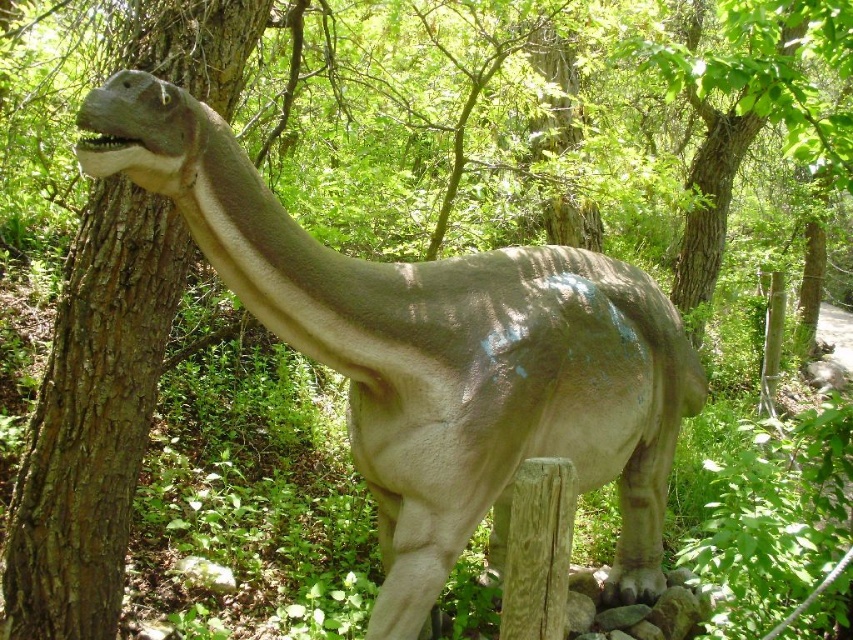
You are a tour guide leading a group of children through a museum. You want to ensure that the children maintain a safe distance of at least 2 meters from the smooth gray dinosaur at center for safety reasons. Based on the current distance between the viewer and the dinosaur, is the group currently within the required safety zone?

The smooth gray dinosaur at center and viewer are 2.44 meters apart from each other. Since the required safety distance is at least 2 meters, the group is currently within the required safety zone as they are slightly farther than the minimum distance.

You are standing in front of the Brachiosaurus model in the forest. If you want to touch the brown rough tree trunk at left, which direction should you move relative to the dinosaur?

The brown rough tree trunk at left is located at point coordinates of (93, 417), so you should move to the left side of the Brachiosaurus model to reach it.